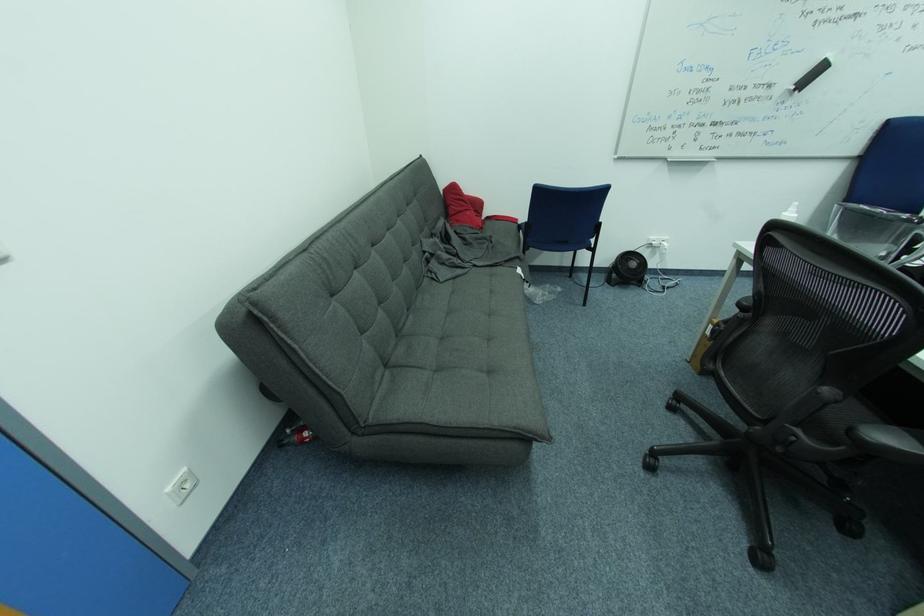
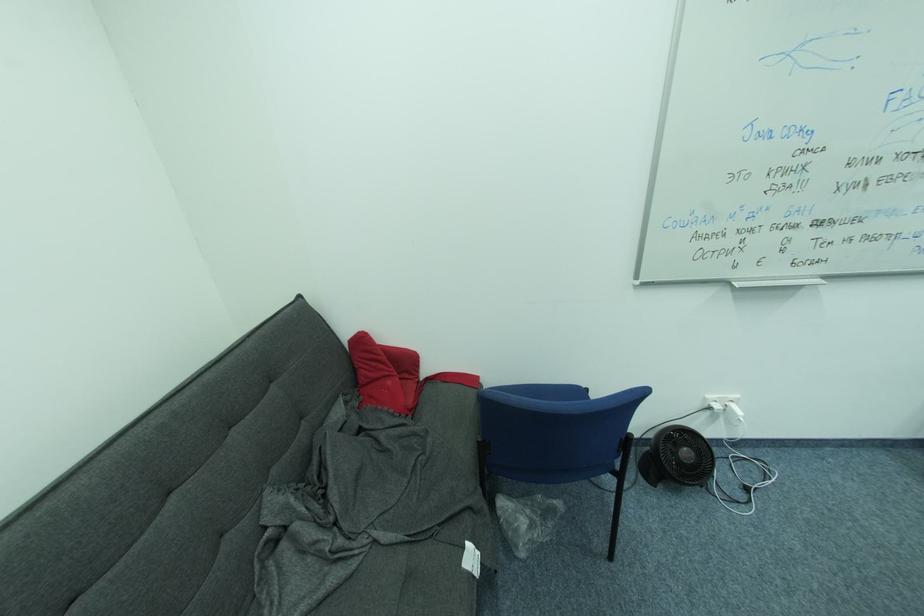
In the second image, find the point that corresponds to (613,285) in the first image.

(648, 479)